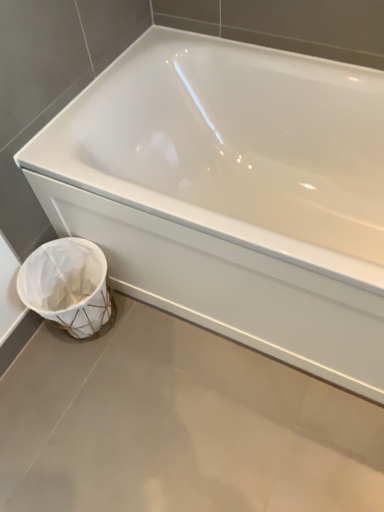
This screenshot has width=384, height=512. I want to click on vacant space to the right of white woven basket at lower left, so click(x=149, y=334).